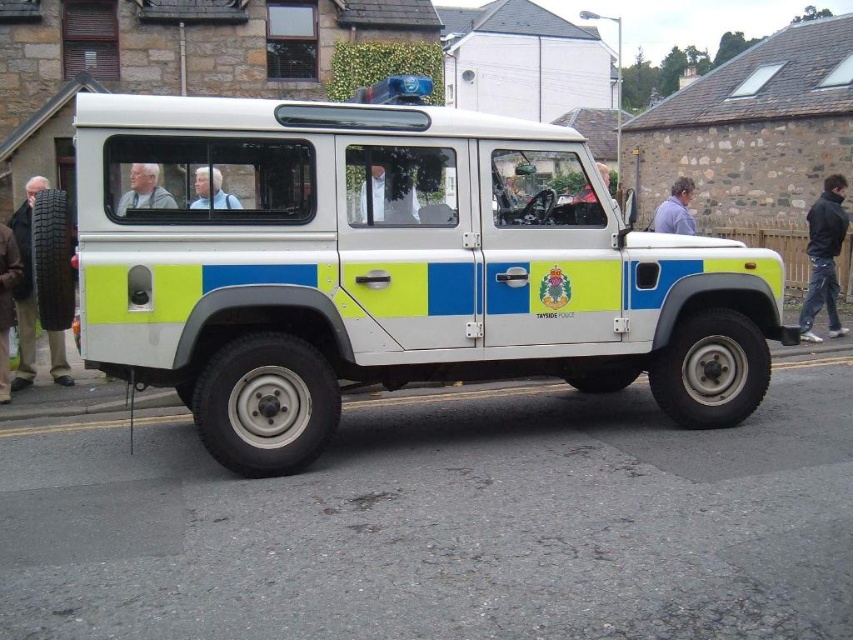
You are a pedestrian on the sidewalk and see the white fabric shirt at center and the gray hair at center. Which one is higher up?

The white fabric shirt at center is above the gray hair at center, so the white fabric shirt at center is higher up.

You are a delivery person who needs to place a package on the roof of the white Land Rover vehicle parked on the street. The package must be placed at the exact center of the roof. Given the coordinates provided for the light brown leather jacket at left, can you determine if the jacket is positioned to the left or right of the center point of the roof?

The light brown leather jacket at left is positioned at coordinates point (x=25, y=284). Since the center of the roof would be at approximately 0.5 on the x and y axes, the jacket is to the left of the center point of the roof.